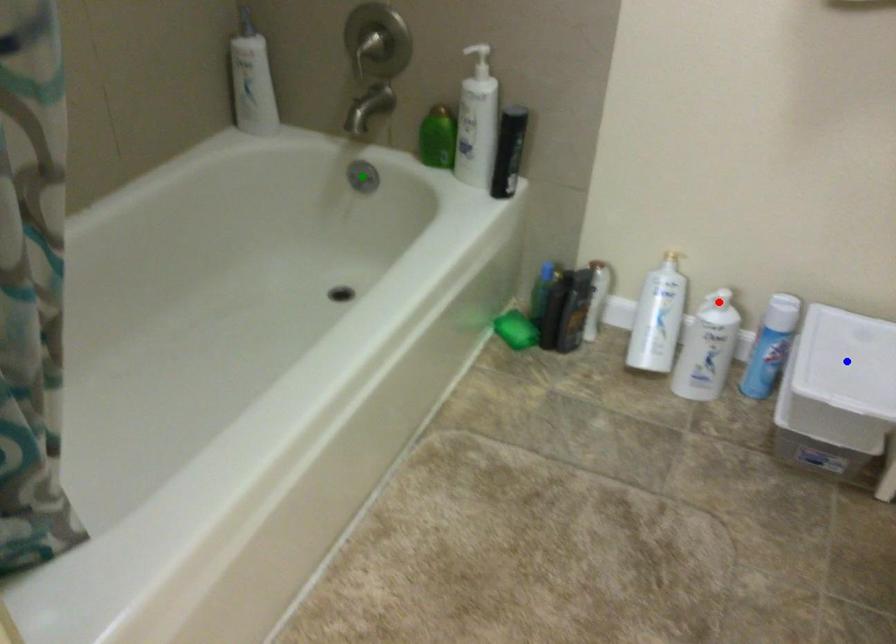
Order these from nearest to farthest:
blue point, red point, green point

green point, red point, blue point